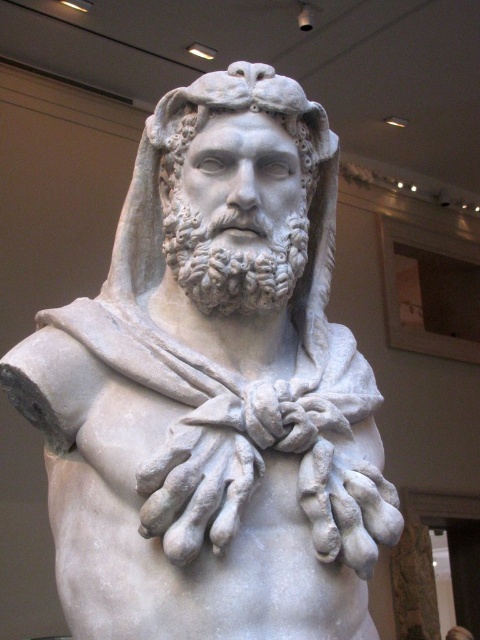
Who is lower down, white marble head at center or white marble hands at center?

white marble hands at center is below.

Who is taller, white marble head at center or white marble hands at center?

white marble head at center

At what (x,y) coordinates should I click in order to perform the action: click on white marble head at center. Please return your answer as a coordinate pair (x, y). Image resolution: width=480 pixels, height=640 pixels. Looking at the image, I should click on (235, 112).

This screenshot has height=640, width=480. I want to click on white marble head at center, so click(x=235, y=112).